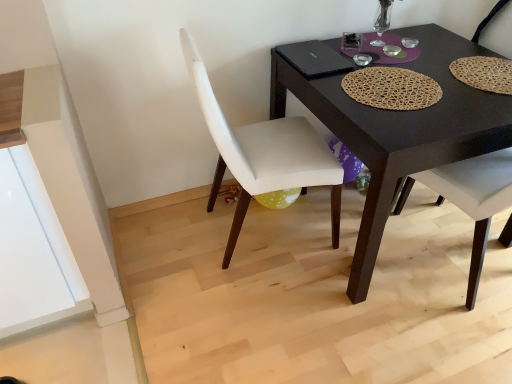
Question: Does black matte laptop at upper center have a greater width compared to matte white chair at right, the second chair when ordered from left to right?

Choices:
 (A) no
 (B) yes

Answer: (A)

Question: Can you confirm if black matte laptop at upper center is smaller than matte white chair at right, which appears as the first chair when viewed from the right?

Choices:
 (A) yes
 (B) no

Answer: (A)

Question: Is black matte laptop at upper center to the left of matte white chair at right, the second chair when ordered from left to right, from the viewer's perspective?

Choices:
 (A) no
 (B) yes

Answer: (B)

Question: From a real-world perspective, is black matte laptop at upper center over matte white chair at right, the second chair when ordered from left to right?

Choices:
 (A) no
 (B) yes

Answer: (B)

Question: Is black matte laptop at upper center positioned beyond the bounds of matte white chair at right, the second chair when ordered from left to right?

Choices:
 (A) no
 (B) yes

Answer: (B)

Question: From a real-world perspective, is black matte laptop at upper center above or below matte white chair at right, which appears as the first chair when viewed from the right?

Choices:
 (A) below
 (B) above

Answer: (B)

Question: From the image's perspective, relative to matte white chair at right, the second chair when ordered from left to right, is black matte laptop at upper center above or below?

Choices:
 (A) above
 (B) below

Answer: (A)

Question: Is point click(x=304, y=43) closer or farther from the camera than point click(x=457, y=172)?

Choices:
 (A) farther
 (B) closer

Answer: (A)

Question: Based on their sizes in the image, would you say black matte laptop at upper center is bigger or smaller than matte white chair at right, which appears as the first chair when viewed from the right?

Choices:
 (A) small
 (B) big

Answer: (A)

Question: In terms of size, does black matte laptop at upper center appear bigger or smaller than white leather chair at center, which is the 1th chair from left to right?

Choices:
 (A) big
 (B) small

Answer: (B)

Question: From the image's perspective, is black matte laptop at upper center located above or below white leather chair at center, which is the 1th chair from left to right?

Choices:
 (A) below
 (B) above

Answer: (B)

Question: Do you think black matte laptop at upper center is within white leather chair at center, the second chair positioned from the right, or outside of it?

Choices:
 (A) inside
 (B) outside

Answer: (A)

Question: Considering the positions of black matte laptop at upper center and white leather chair at center, the second chair positioned from the right, in the image, is black matte laptop at upper center wider or thinner than white leather chair at center, the second chair positioned from the right,?

Choices:
 (A) wide
 (B) thin

Answer: (B)

Question: In the image, is black matte desk at center positioned in front of or behind white leather chair at center, the second chair positioned from the right?

Choices:
 (A) front
 (B) behind

Answer: (A)

Question: From their relative heights in the image, would you say black matte desk at center is taller or shorter than white leather chair at center, which is the 1th chair from left to right?

Choices:
 (A) short
 (B) tall

Answer: (A)